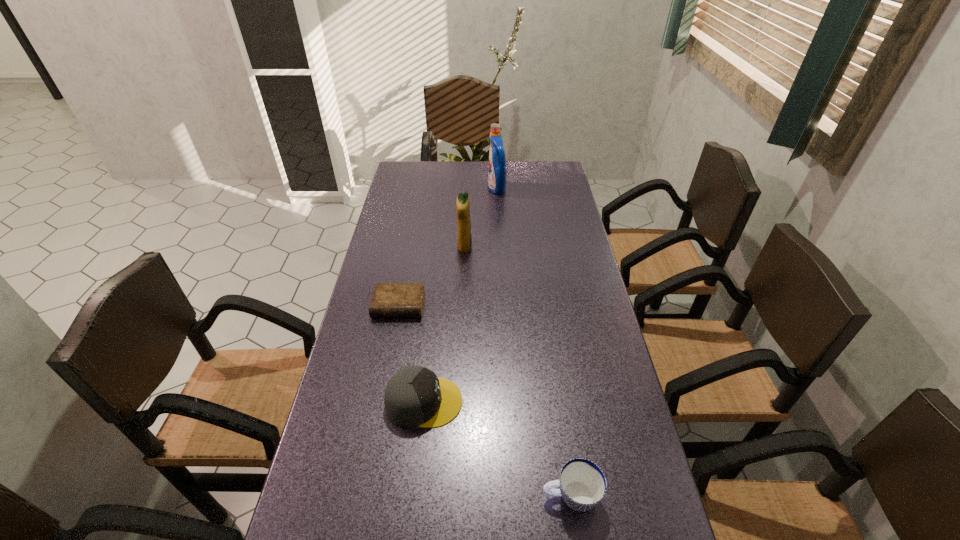
You are a GUI agent. You are given a task and a screenshot of the screen. Output one action in this format:
    pyautogui.click(x=<x>, y=<y>)
    Task: Click on the diary at the left edge
    This screenshot has height=540, width=960.
    Given the screenshot: What is the action you would take?
    pyautogui.click(x=389, y=300)

Where is `object situated at the right edge`? This screenshot has height=540, width=960. object situated at the right edge is located at coordinates (582, 483).

Where is `vacant space at the left edge of the desktop`? vacant space at the left edge of the desktop is located at coordinates (389, 325).

Find the location of a particular element. This screenshot has height=540, width=960. vacant space at the right edge of the desktop is located at coordinates (607, 507).

Where is `vacant region at the far left corner of the desktop`? The height and width of the screenshot is (540, 960). vacant region at the far left corner of the desktop is located at coordinates (415, 181).

The width and height of the screenshot is (960, 540). In the image, there is a desktop. In order to click on vacant space at the far right corner in this screenshot , I will do `click(534, 174)`.

Find the location of `free space between the left detergent and the right detergent`. free space between the left detergent and the right detergent is located at coordinates (481, 218).

The height and width of the screenshot is (540, 960). Identify the location of vacant area that lies between the rightmost object and the second farthest object. (517, 372).

At what (x,y) coordinates should I click in order to perform the action: click on unoccupied area between the second nearest object and the shortest object. Please return your answer as a coordinate pair (x, y). Image resolution: width=960 pixels, height=540 pixels. Looking at the image, I should click on (412, 354).

Find the location of a particular element. The height and width of the screenshot is (540, 960). vacant region between the second nearest object and the third nearest object is located at coordinates (412, 354).